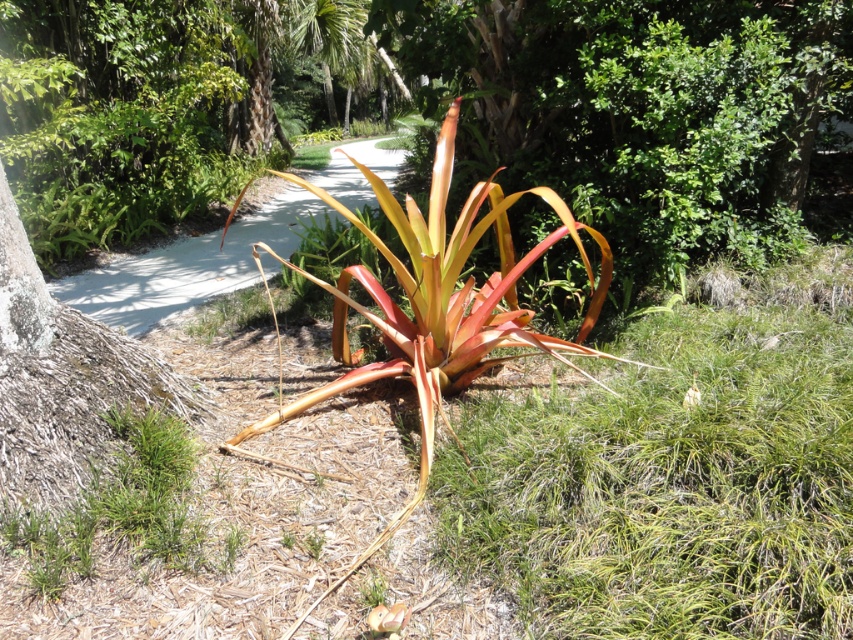
Question: Considering the relative positions of white concrete path at center and matte orange leaf at center in the image provided, where is white concrete path at center located with respect to matte orange leaf at center?

Choices:
 (A) below
 (B) above

Answer: (B)

Question: Where is white concrete path at center located in relation to white fluffy flower at center in the image?

Choices:
 (A) right
 (B) left

Answer: (B)

Question: Which point is farther to the camera?

Choices:
 (A) white fluffy flower at center
 (B) matte orange leaf at center

Answer: (A)

Question: Which of these objects is positioned farthest from the matte orange leaf at center?

Choices:
 (A) white fluffy flower at center
 (B) white concrete path at center

Answer: (B)

Question: Which of the following is the closest to the observer?

Choices:
 (A) white fluffy flower at center
 (B) matte orange leaf at center
 (C) white concrete path at center

Answer: (B)

Question: In this image, where is white concrete path at center located relative to matte orange leaf at center?

Choices:
 (A) below
 (B) above

Answer: (B)